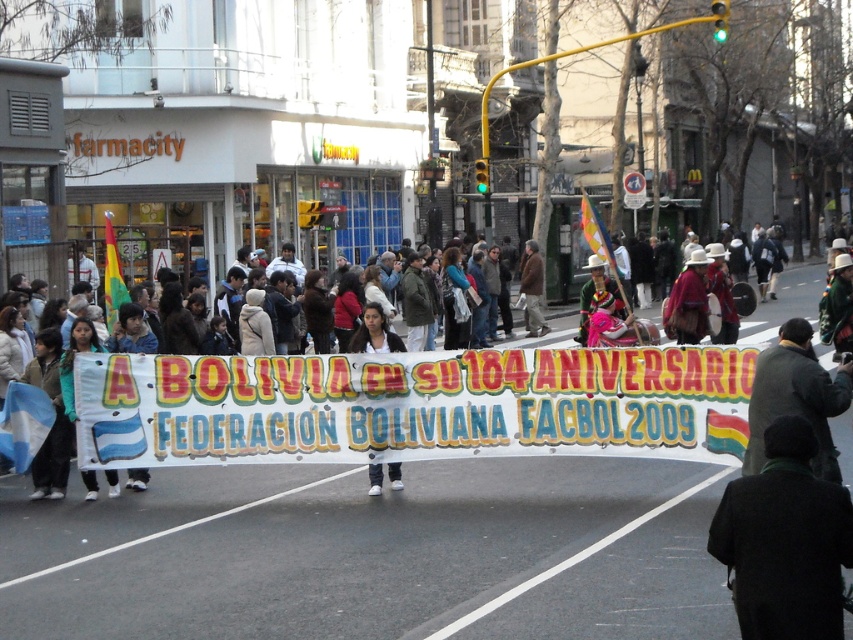
Is dark gray coat at lower right above white fabric banner at center?

Incorrect, dark gray coat at lower right is not positioned above white fabric banner at center.

Is dark gray coat at lower right smaller than white fabric banner at center?

No, dark gray coat at lower right is not smaller than white fabric banner at center.

What do you see at coordinates (796, 396) in the screenshot? This screenshot has height=640, width=853. I see `dark gray coat at lower right` at bounding box center [796, 396].

You are a GUI agent. You are given a task and a screenshot of the screen. Output one action in this format:
    pyautogui.click(x=<x>, y=<y>)
    Task: Click on the dark gray coat at lower right
    This screenshot has width=853, height=640.
    Given the screenshot: What is the action you would take?
    pyautogui.click(x=796, y=396)

Does black wool coat at lower right lie behind matte brown dress at center?

No.

Between black wool coat at lower right and matte brown dress at center, which one appears on the left side from the viewer's perspective?

Result: black wool coat at lower right is more to the left.

Which is in front, point (814, 497) or point (694, 342)?

Positioned in front is point (814, 497).

Locate an element on the screen. black wool coat at lower right is located at coordinates (784, 540).

Who is positioned more to the left, black wool coat at lower right or dark gray coat at lower right?

black wool coat at lower right is more to the left.

Where is `black wool coat at lower right`? The width and height of the screenshot is (853, 640). black wool coat at lower right is located at coordinates (784, 540).

Measure the distance between black wool coat at lower right and camera.

black wool coat at lower right and camera are 4.60 meters apart from each other.

Locate an element on the screen. Image resolution: width=853 pixels, height=640 pixels. black wool coat at lower right is located at coordinates (784, 540).